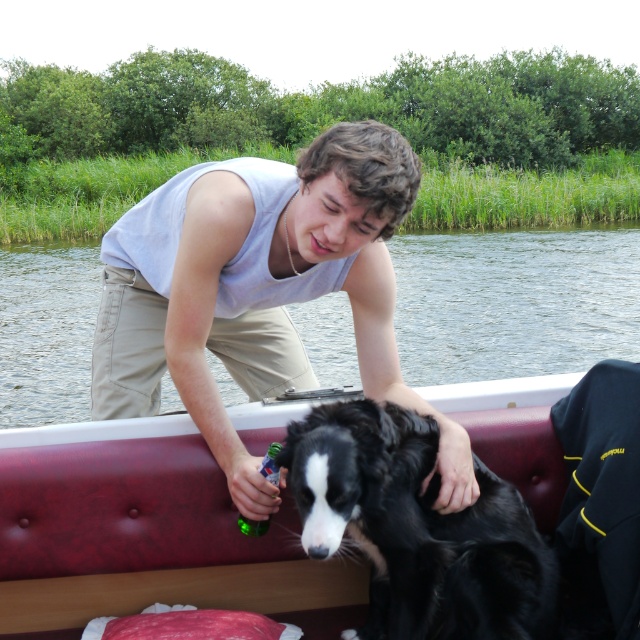
From the picture: You are a photographer trying to capture the scene of the person and the dog on the boat. You need to ensure that both the gray cotton tank top at upper center and the black glossy fur at center are visible in the frame. Given their sizes, which object should you prioritize framing closer to avoid cropping?

The gray cotton tank top at upper center has a larger width than the black glossy fur at center, so you should prioritize framing the gray cotton tank top at upper center closer to avoid cropping.

You are standing on the boat and need to reach the gray cotton tank top at upper center. The jacket is hanging on the back of the bench. Can you grab it without moving from your current position?

The gray cotton tank top at upper center is 7.58 feet away from the camera. Since you are on the boat, the distance might be too far to reach without moving closer. Consider moving towards the jacket to grab it.

You are standing at the camera position and want to reach both the point at coordinates point (157, 493) and the point at coordinates point (595, 294). Which point should you reach first?

You should reach the point at coordinates point (157, 493) first because it is closer to the camera than the point at coordinates point (595, 294).